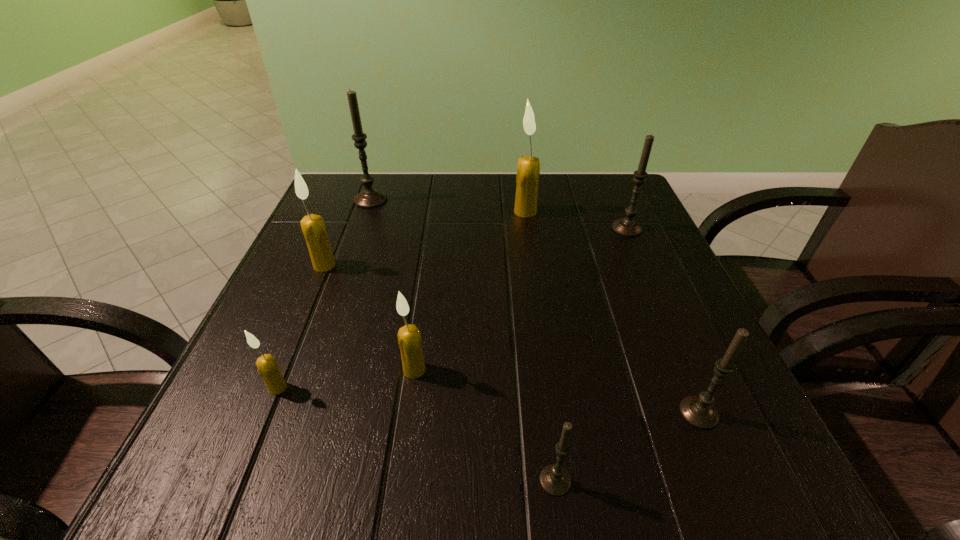
The height and width of the screenshot is (540, 960). Find the location of `the second nearest object`. the second nearest object is located at coordinates click(x=699, y=411).

Where is `the seventh farthest candle`? This screenshot has width=960, height=540. the seventh farthest candle is located at coordinates (699, 411).

Find the location of `the sixth farthest object`. the sixth farthest object is located at coordinates (266, 364).

Locate an element on the screen. The image size is (960, 540). the nearest cream candle is located at coordinates (266, 364).

Locate an element on the screen. This screenshot has width=960, height=540. the nearest gray candle is located at coordinates (555, 480).

Locate an element on the screen. This screenshot has height=540, width=960. the smallest gray candle is located at coordinates (555, 480).

Find the location of a particular element. Image resolution: width=960 pixels, height=540 pixels. vacant space situated on the front of the biggest cream candle is located at coordinates (540, 312).

Locate an element on the screen. This screenshot has height=540, width=960. vacant area located 0.290m on the front of the farthest gray candle is located at coordinates (339, 289).

Identify the location of vacant space located 0.380m on the left of the third farthest candle. (445, 228).

Identify the location of vacant space located 0.070m on the front of the fifth nearest candle. This screenshot has height=540, width=960. (312, 296).